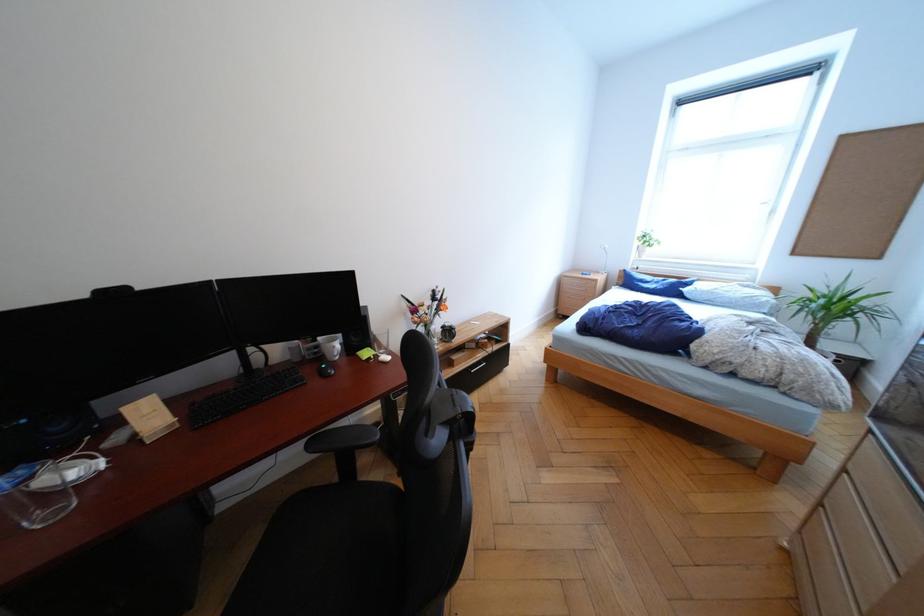
Describe the element at coordinates (335, 349) in the screenshot. The height and width of the screenshot is (616, 924). I see `the white mug handle` at that location.